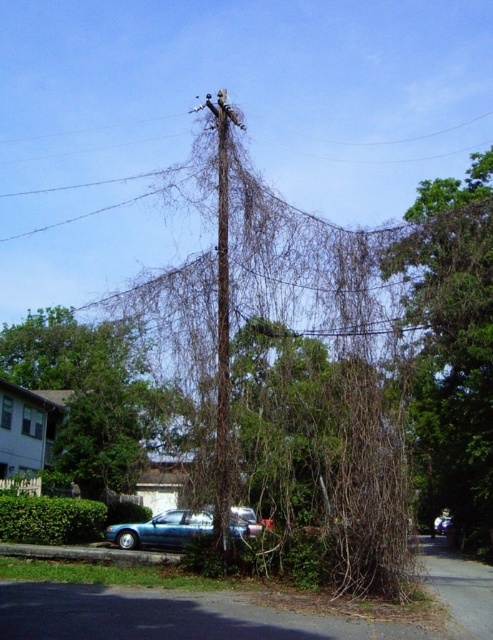
You are standing in front of the utility pole and notice a green leafy tree at center. Based on its position, can you determine if the tree is closer to the pole or further away from it?

The green leafy tree at center is located at point (97, 397), which indicates it is closer to the pole than the vines since it has a lower y coordinate.

You are a photographer wanting to capture both the green leafy tree at center and the teal metallic car at center in a single frame. Which object will appear bigger in the photo?

The green leafy tree at center will appear bigger in the photo because it has a larger size compared to the teal metallic car at center.

You are standing in front of the utility pole and want to take a photo of the teal metallic car at center without the brown textured vines at upper right blocking the view. Is the car positioned behind or in front of the vines?

The brown textured vines at upper right are closer to the viewer than the teal metallic car at center, so the car is positioned behind the vines and would be blocked from view.